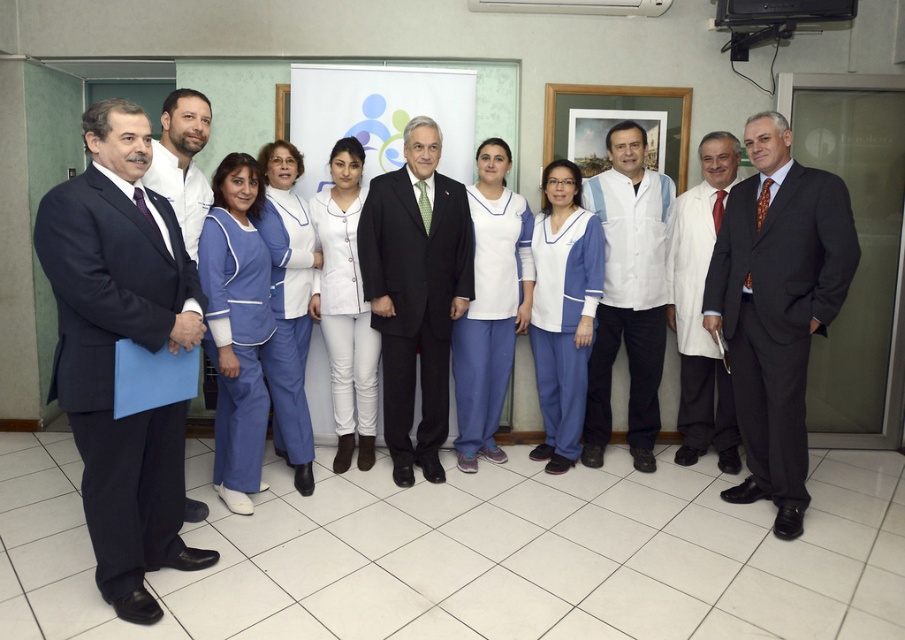
Does blue scrubs at center lie behind white smooth uniform at center?

No, blue scrubs at center is closer to the viewer.

Does blue scrubs at center appear under white smooth uniform at center?

Indeed, blue scrubs at center is positioned under white smooth uniform at center.

Describe the element at coordinates (236, 324) in the screenshot. I see `blue scrubs at center` at that location.

I want to click on blue scrubs at center, so click(236, 324).

Can you confirm if white lab coat at right is taller than matte white coat at left?

Correct, white lab coat at right is much taller as matte white coat at left.

Where is `white lab coat at right`? white lab coat at right is located at coordinates (699, 308).

Where is `white lab coat at right`? The image size is (905, 640). white lab coat at right is located at coordinates (699, 308).

Can you confirm if blue scrubs at center is thinner than matte white coat at left?

In fact, blue scrubs at center might be wider than matte white coat at left.

Can you confirm if blue scrubs at center is taller than matte white coat at left?

Yes.

Measure the distance between blue scrubs at center and camera.

blue scrubs at center and camera are 9.87 feet apart from each other.

Where is `blue scrubs at center`? blue scrubs at center is located at coordinates tap(236, 324).